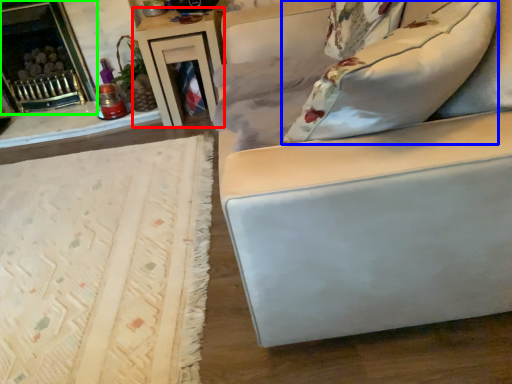
Question: Which is nearer to the table (highlighted by a red box)? pillow (highlighted by a blue box) or fireplace (highlighted by a green box).

Choices:
 (A) pillow
 (B) fireplace

Answer: (B)